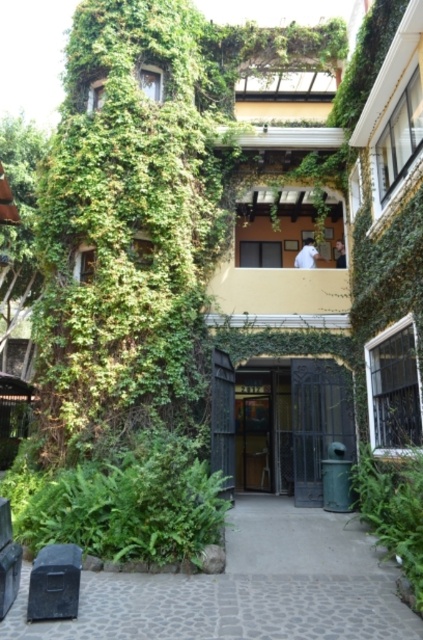
Can you confirm if gray cobblestone alley at center is positioned below green leafy plant at lower right?

Yes, gray cobblestone alley at center is below green leafy plant at lower right.

Is point (79, 602) less distant than point (392, 497)?

That is True.

What are the coordinates of `gray cobblestone alley at center` in the screenshot? It's located at pos(247,588).

Does green leafy bush at lower left have a smaller size compared to green leafy plant at lower right?

Incorrect, green leafy bush at lower left is not smaller in size than green leafy plant at lower right.

Is point (87, 534) positioned behind point (395, 540)?

Yes, point (87, 534) is farther from viewer.

I want to click on green leafy bush at lower left, so click(x=123, y=502).

Describe the element at coordinates (247, 588) in the screenshot. I see `gray cobblestone alley at center` at that location.

This screenshot has height=640, width=423. Identify the location of gray cobblestone alley at center. (247, 588).

At what (x,y) coordinates should I click in order to perform the action: click on gray cobblestone alley at center. Please return your answer as a coordinate pair (x, y). The width and height of the screenshot is (423, 640). Looking at the image, I should click on (247, 588).